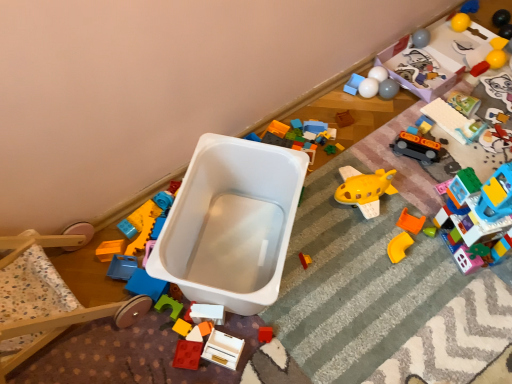
This screenshot has height=384, width=512. I want to click on empty space that is in between orange plastic train at center, the eleventh toy positioned from the left, and translucent plastic building blocks at right, arranged as the 5th toy when viewed from the right, so click(426, 180).